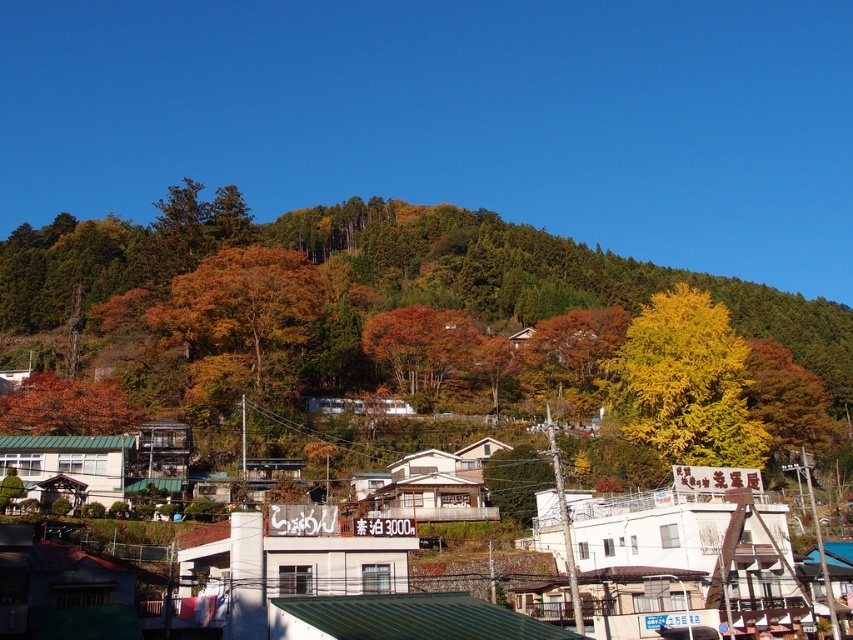
Question: From the image, what is the correct spatial relationship of yellow/golden leaves at upper center in relation to yellow/golden/yellowish-green leafy tree at center-right?

Choices:
 (A) left
 (B) right

Answer: (A)

Question: Can you confirm if yellow/golden leaves at upper center is wider than yellow/golden/yellowish-green leafy tree at center-right?

Choices:
 (A) no
 (B) yes

Answer: (B)

Question: Which of the following is the farthest from the observer?

Choices:
 (A) (335, 237)
 (B) (628, 376)
 (C) (12, 429)

Answer: (A)

Question: Is yellow/golden leaves at upper center closer to the viewer compared to yellow/golden/yellowish-green leafy tree at center-right?

Choices:
 (A) yes
 (B) no

Answer: (A)

Question: Which is farther from the yellow/golden/yellowish-green leafy tree at center-right?

Choices:
 (A) yellow/golden leaves at upper center
 (B) orange matte tree at lower left

Answer: (A)

Question: Considering the real-world distances, which object is closest to the yellow/golden leaves at upper center?

Choices:
 (A) yellow/golden/yellowish-green leafy tree at center-right
 (B) orange matte tree at lower left

Answer: (A)